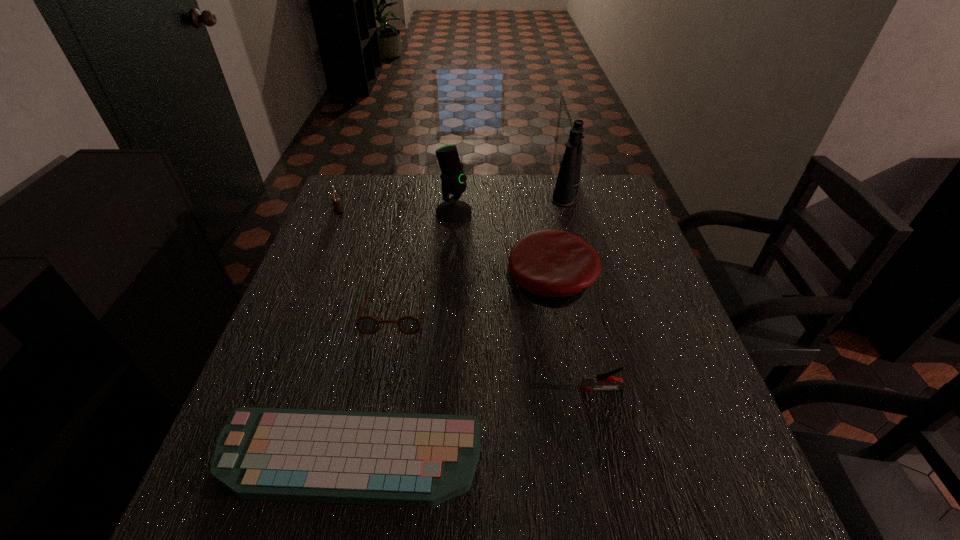
Identify the location of vacant area at the far edge of the desktop. The width and height of the screenshot is (960, 540). (465, 194).

The height and width of the screenshot is (540, 960). I want to click on blank area at the left edge, so click(313, 364).

Find the location of a particular element. vacant space at the right edge is located at coordinates (675, 314).

Identify the location of vacant region at the near left corner of the desktop. The height and width of the screenshot is (540, 960). (293, 526).

Where is `free space at the far right corner of the desktop`? The height and width of the screenshot is (540, 960). free space at the far right corner of the desktop is located at coordinates (583, 198).

At what (x,y) coordinates should I click in order to perform the action: click on vacant space at the near right corner of the desktop. Please return your answer as a coordinate pair (x, y). This screenshot has width=960, height=540. Looking at the image, I should click on (738, 497).

I want to click on free spot between the sixth tallest object and the stapler, so click(498, 351).

This screenshot has width=960, height=540. What are the coordinates of `free spot between the padlock and the third tallest object` in the screenshot? It's located at (444, 248).

Where is `vacant space that is in between the microphone and the binoculars`? This screenshot has height=540, width=960. vacant space that is in between the microphone and the binoculars is located at coordinates pos(510,202).

Where is `vacant region between the padlock and the sixth farthest object`? vacant region between the padlock and the sixth farthest object is located at coordinates (470, 300).